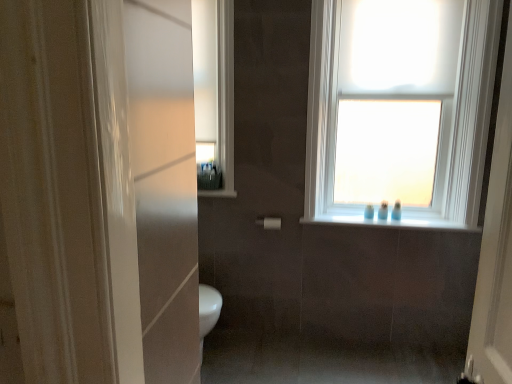
Locate an element on the screen. Image resolution: width=512 pixels, height=384 pixels. vacant space that is to the left of blue plastic toothbrushes at window, which appears as the second toiletry when viewed from the right is located at coordinates (359, 218).